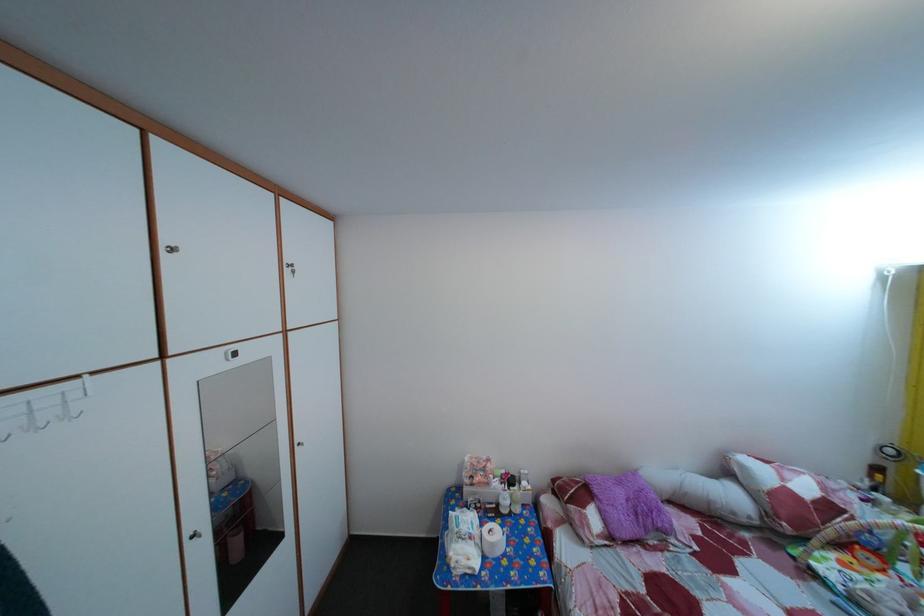
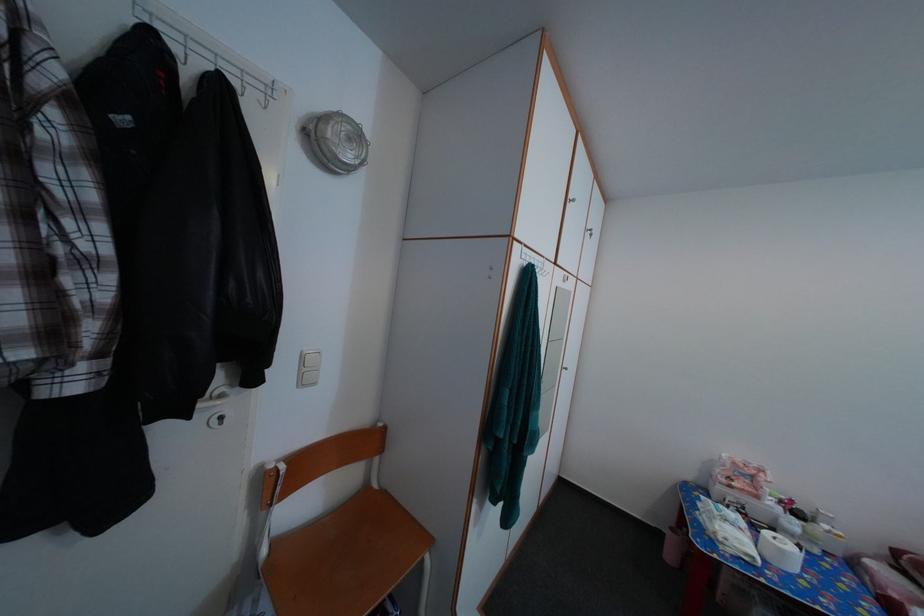
Question: Based on the continuous images, in which direction is the camera rotating? Reply with the corresponding letter.

Choices:
 (A) Left
 (B) Right
 (C) Up
 (D) Down

Answer: (A)